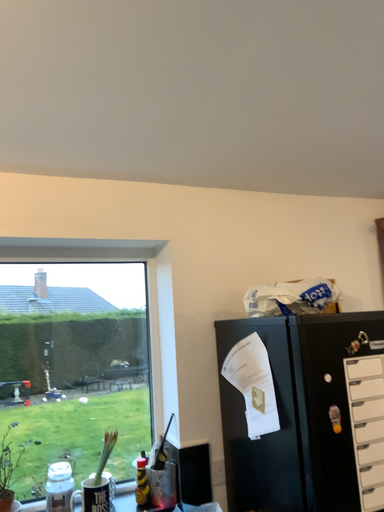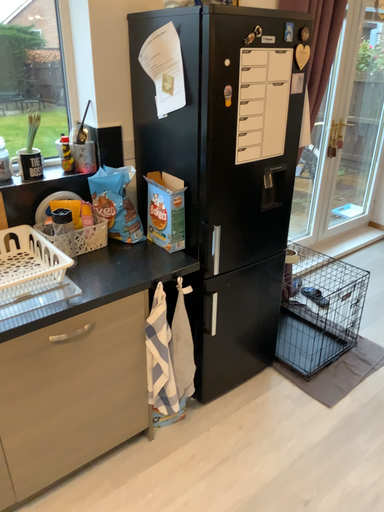
Question: Which way did the camera rotate in the video?

Choices:
 (A) rotated downward
 (B) rotated upward

Answer: (A)